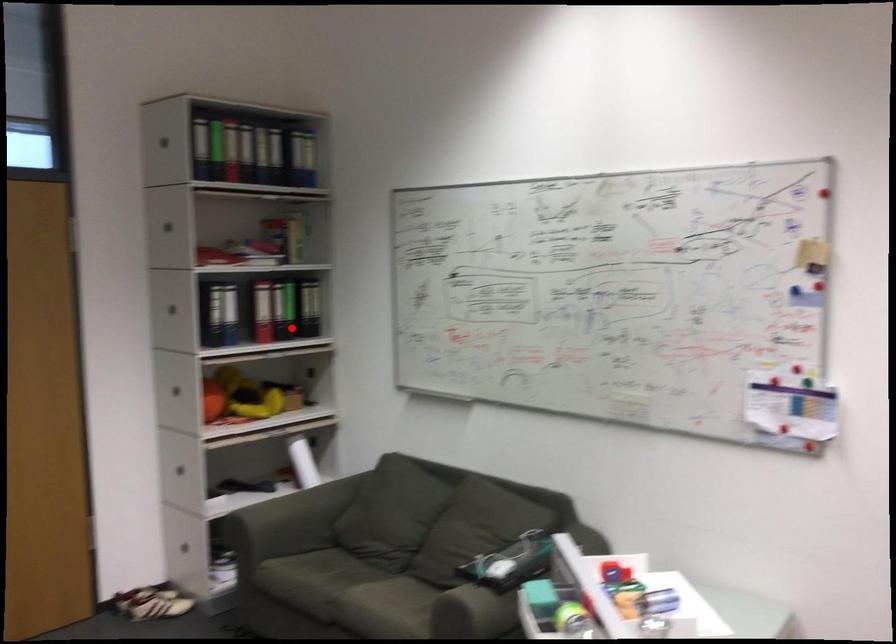
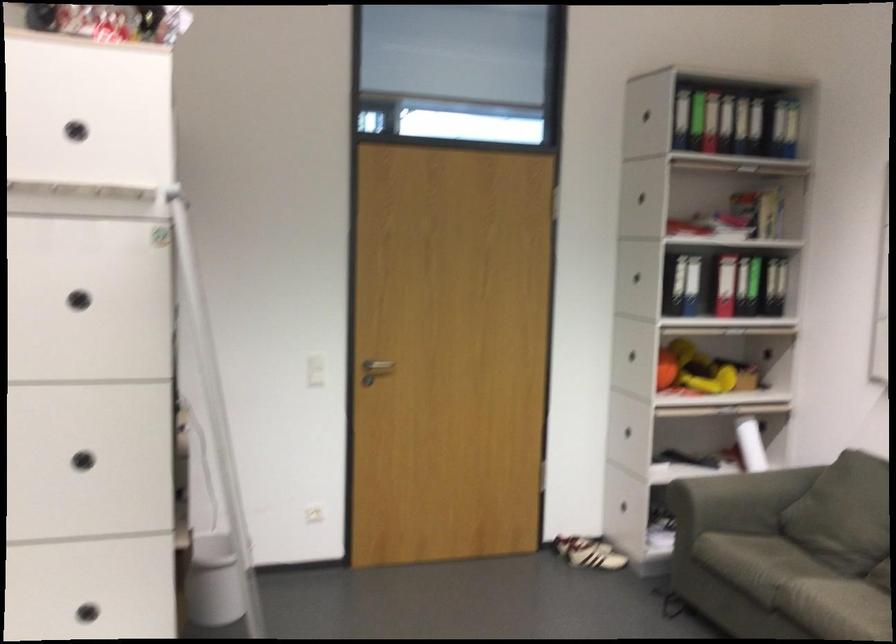
Question: I am providing you with two images of the same scene from different viewpoints. In image1, a red point is highlighted. Considering the same 3D point in image2, which of the following is correct?

Choices:
 (A) It is closer
 (B) It is farther

Answer: (A)